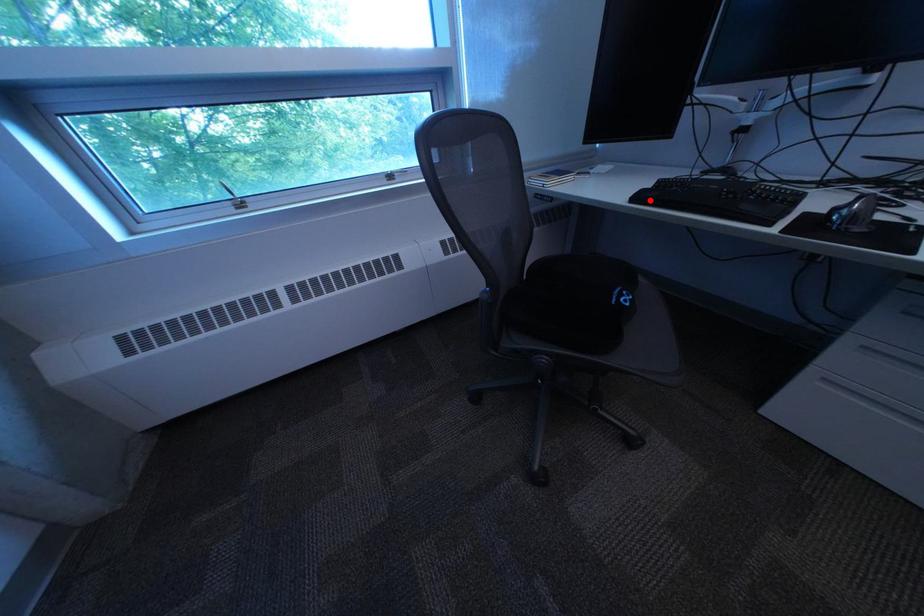
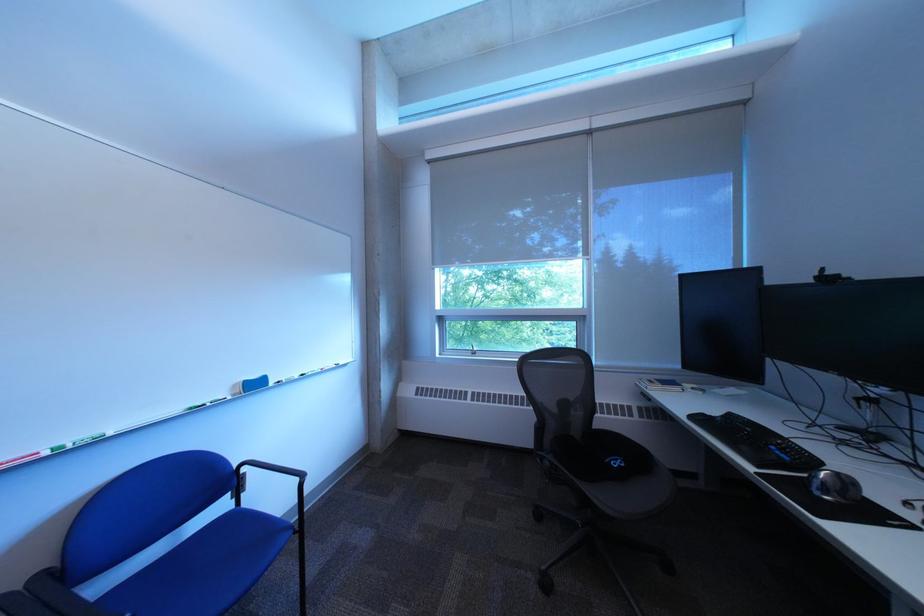
Question: I am providing you with two images of the same scene from different viewpoints. A red point is marked on the first image. Is the red point's position out of view in image 2?

Choices:
 (A) Yes
 (B) No

Answer: (B)